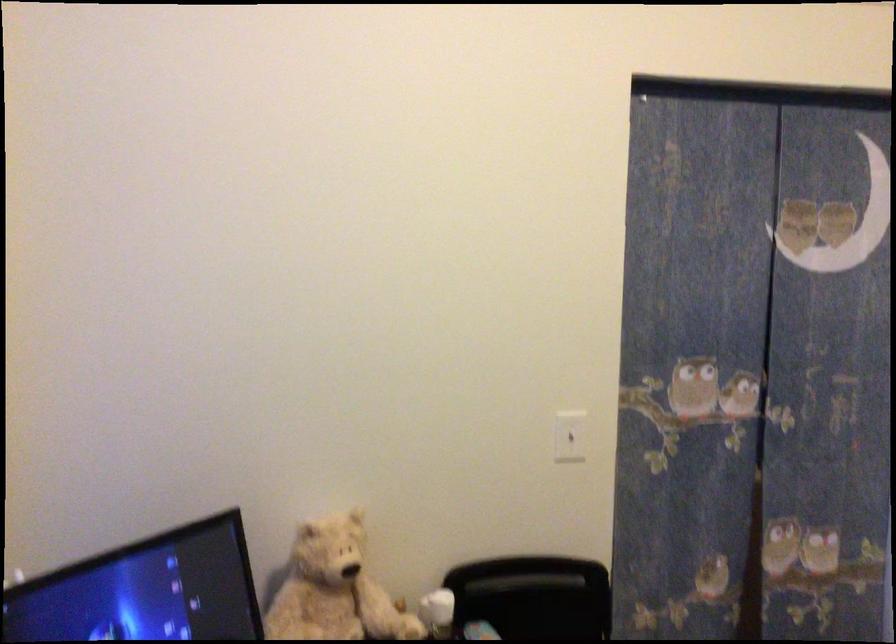
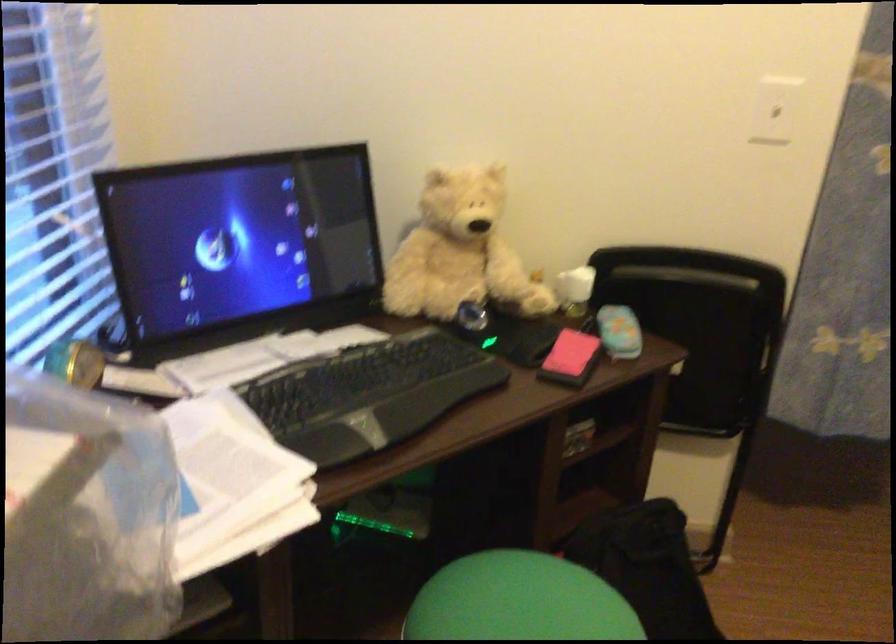
First-person continuous shooting, in which direction is the camera rotating?

The rotation direction of the camera is left-down.